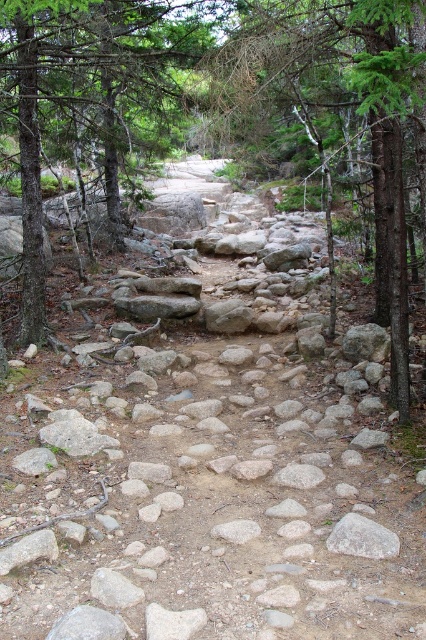
Where is `green textured tree at center`? The width and height of the screenshot is (426, 640). green textured tree at center is located at coordinates (342, 108).

Looking at this image, is green textured tree at center closer to camera compared to gray rough rock at center?

No, it is behind gray rough rock at center.

Does point (425, 150) come in front of point (330, 538)?

No.

What are the coordinates of `green textured tree at center` in the screenshot? It's located at (342, 108).

Which of these two, white smooth rock at center or gray smooth rock at center, stands taller?

white smooth rock at center

Can you confirm if white smooth rock at center is shorter than gray smooth rock at center?

Incorrect, white smooth rock at center's height does not fall short of gray smooth rock at center's.

Does point (298, 480) come closer to viewer compared to point (241, 541)?

That is False.

At what (x,y) coordinates should I click in order to perform the action: click on white smooth rock at center. Please return your answer as a coordinate pair (x, y). The height and width of the screenshot is (640, 426). Looking at the image, I should click on [299, 476].

Does point (245, 35) come closer to viewer compared to point (284, 477)?

No.

Who is more distant from viewer, (396, 86) or (278, 470)?

Point (278, 470)

Which is behind, point (322, 61) or point (291, 468)?

Positioned behind is point (322, 61).

At what (x,y) coordinates should I click in order to perform the action: click on green textured tree at center. Please return your answer as a coordinate pair (x, y). Image resolution: width=426 pixels, height=640 pixels. Looking at the image, I should click on (342, 108).